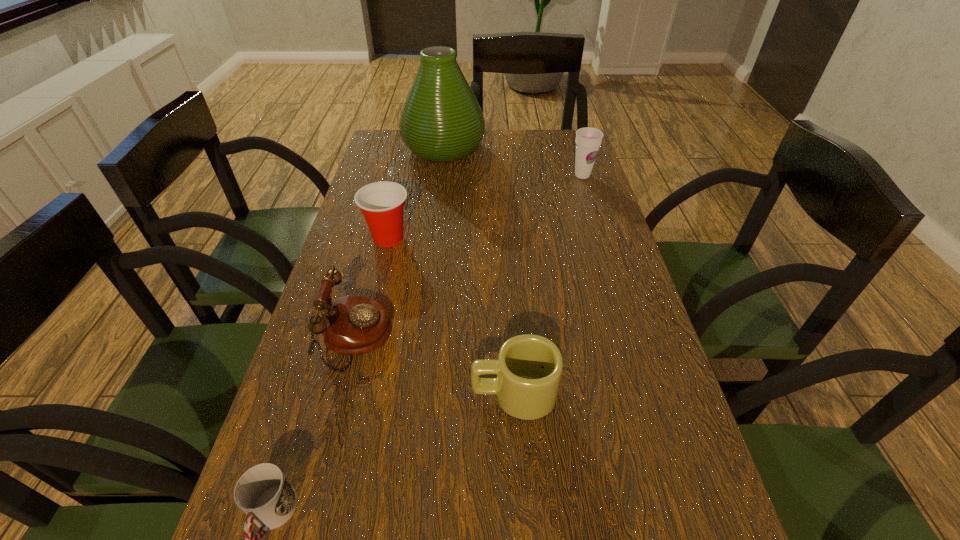
You are a GUI agent. You are given a task and a screenshot of the screen. Output one action in this format:
    pyautogui.click(x=<x>, y=<y>)
    Task: Click on the tallest object
    
    Given the screenshot: What is the action you would take?
    pyautogui.click(x=441, y=120)

The height and width of the screenshot is (540, 960). In order to click on the rightmost object in this screenshot , I will do `click(588, 140)`.

Locate an element on the screen. This screenshot has height=540, width=960. the rightmost cup is located at coordinates (588, 140).

Where is `the third farthest object`? The width and height of the screenshot is (960, 540). the third farthest object is located at coordinates (382, 203).

You are a GUI agent. You are given a task and a screenshot of the screen. Output one action in this format:
    pyautogui.click(x=<x>, y=<y>)
    Task: Click on the telephone
    
    Given the screenshot: What is the action you would take?
    pyautogui.click(x=351, y=325)

The height and width of the screenshot is (540, 960). I want to click on mug, so click(529, 367).

Locate an element on the screen. The width and height of the screenshot is (960, 540). vacant space situated 0.360m on the front of the vase is located at coordinates (433, 240).

Identify the location of free space located on the left of the rightmost object. coord(551,176).

Locate an element on the screen. This screenshot has width=960, height=540. vacant space located 0.100m on the back of the second nearest cup is located at coordinates click(396, 202).

Where is `vacant space located on the dial of the telephone`? vacant space located on the dial of the telephone is located at coordinates (507, 338).